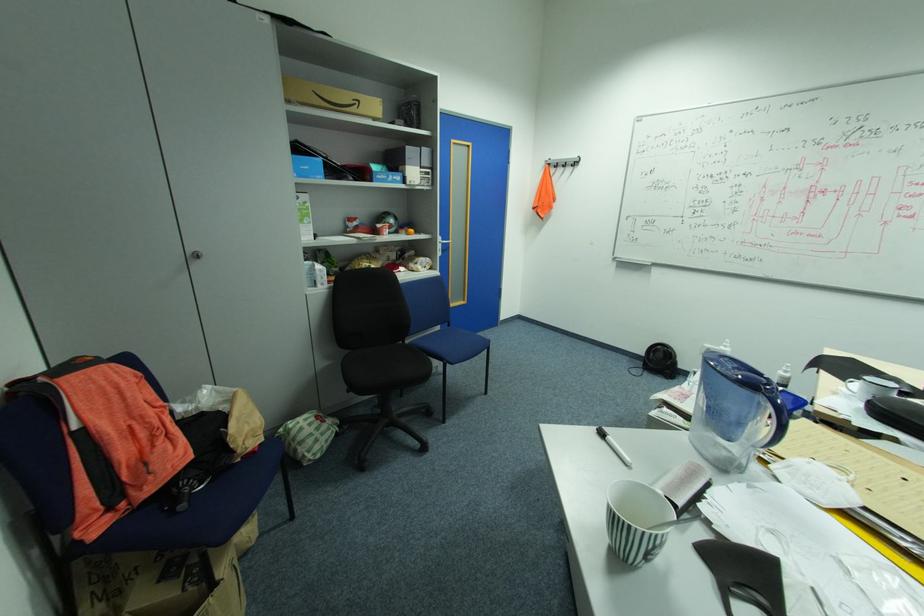
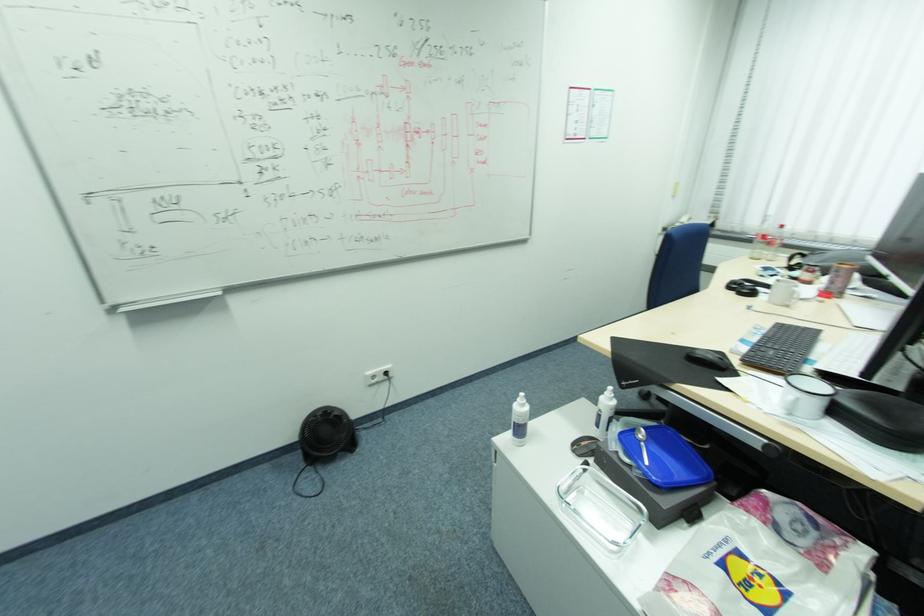
Find the pixel in the second image that matches point 648,363 in the first image.

(304, 456)